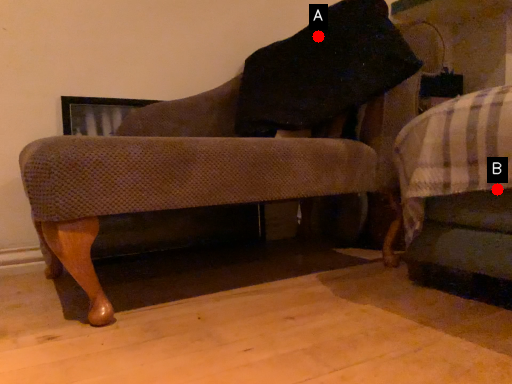
Question: Two points are circled on the image, labeled by A and B beside each circle. Which point is farther from the camera taking this photo?

Choices:
 (A) A is further
 (B) B is further

Answer: (A)